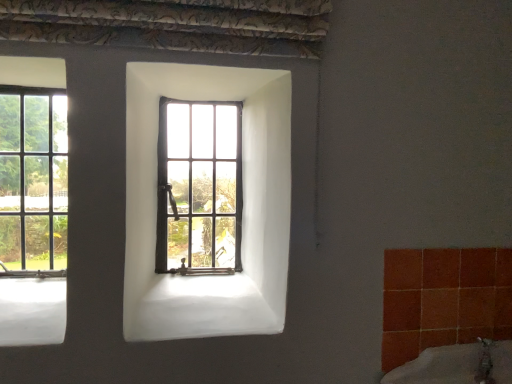
Identify the location of vacant region in front of wooden-framed window at center, the 2th window when ordered from left to right. This screenshot has width=512, height=384. (188, 282).